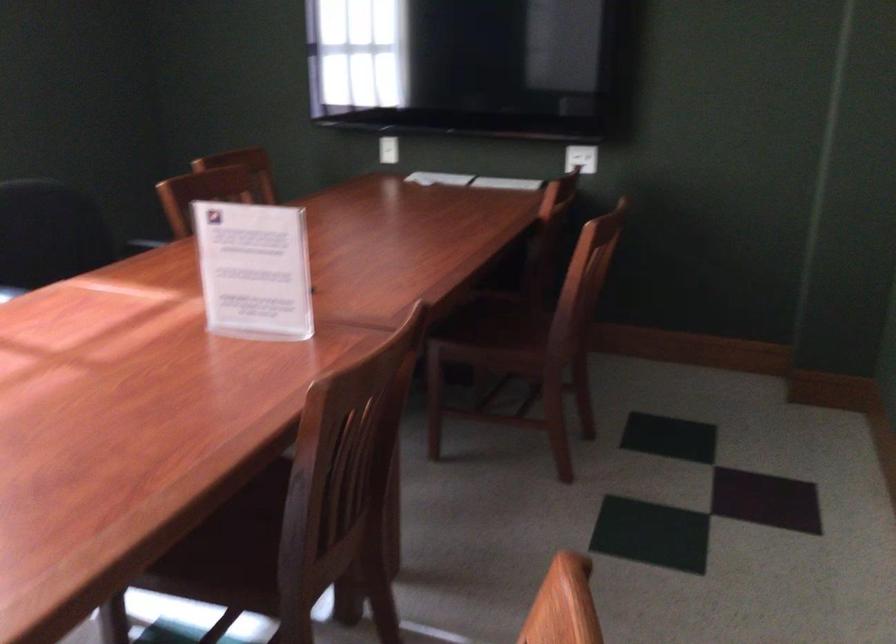
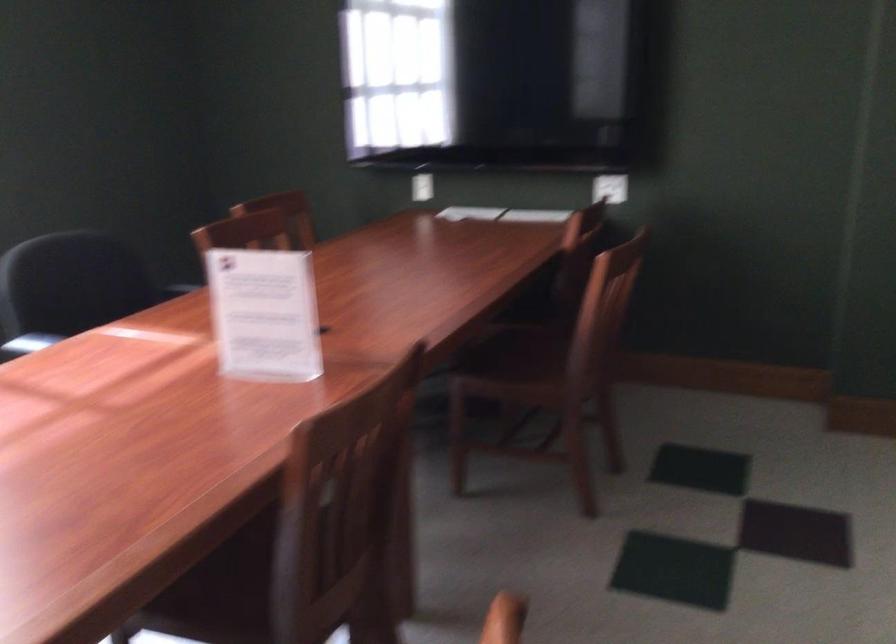
Question: Which direction would the cameraman need to move to produce the second image? Reply with the corresponding letter.

Choices:
 (A) Left
 (B) Right
 (C) Forward
 (D) Backward

Answer: (B)